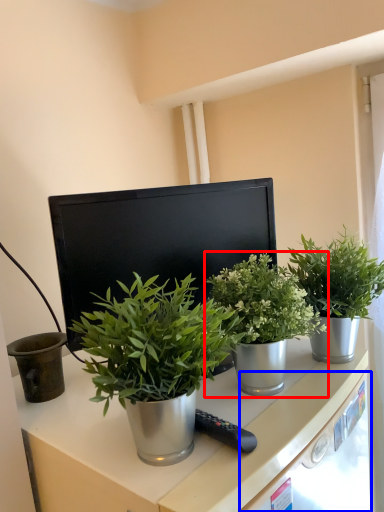
Question: Among these objects, which one is farthest to the camera, houseplant (highlighted by a red box) or drawer (highlighted by a blue box)?

Choices:
 (A) houseplant
 (B) drawer

Answer: (A)